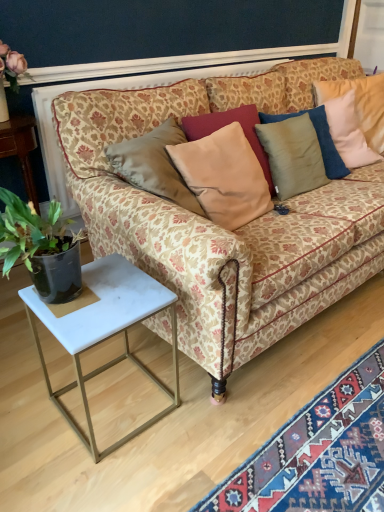
This screenshot has height=512, width=384. I want to click on free spot in front of white marble side table at lower left, so pyautogui.click(x=97, y=478).